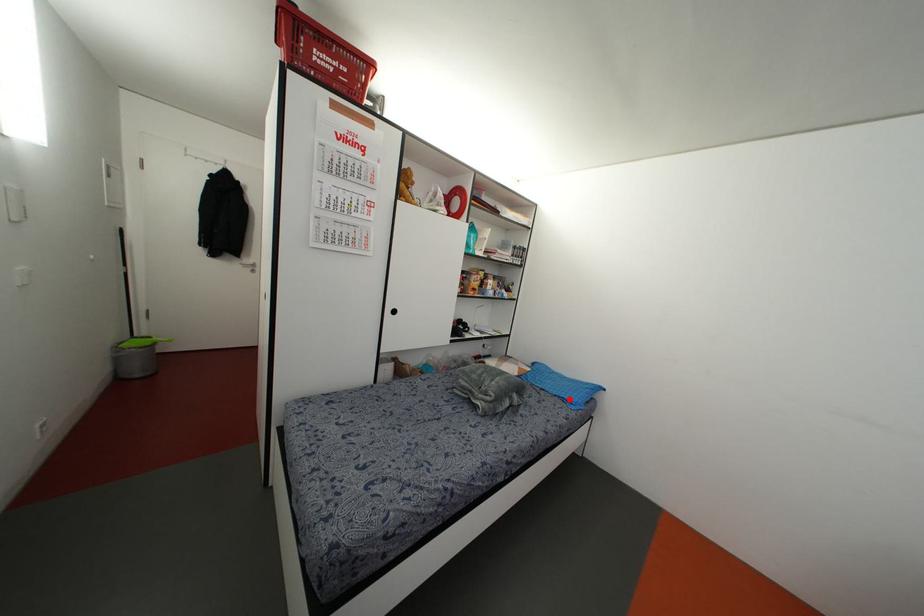
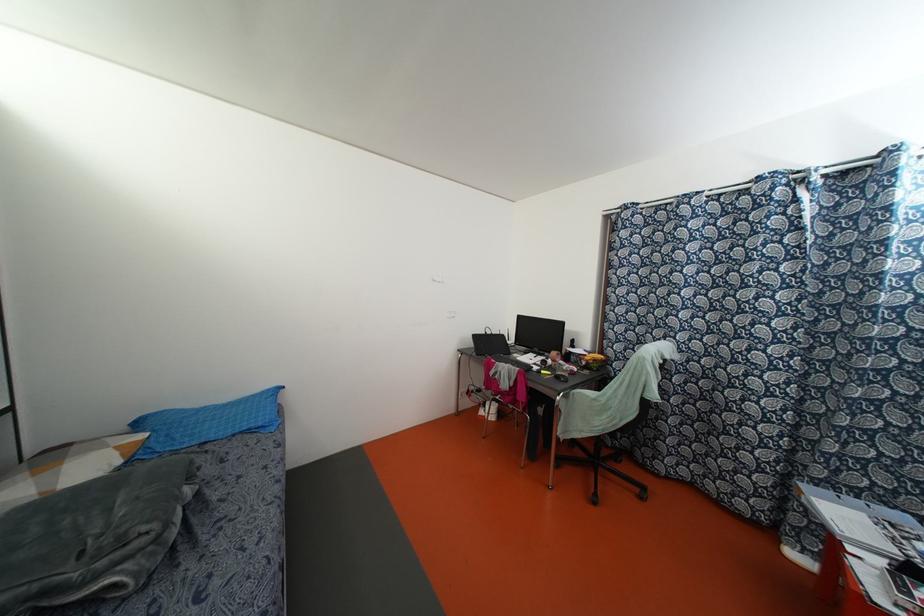
Where in the second image is the point corresponding to the highlighted location from the first image?

(259, 424)